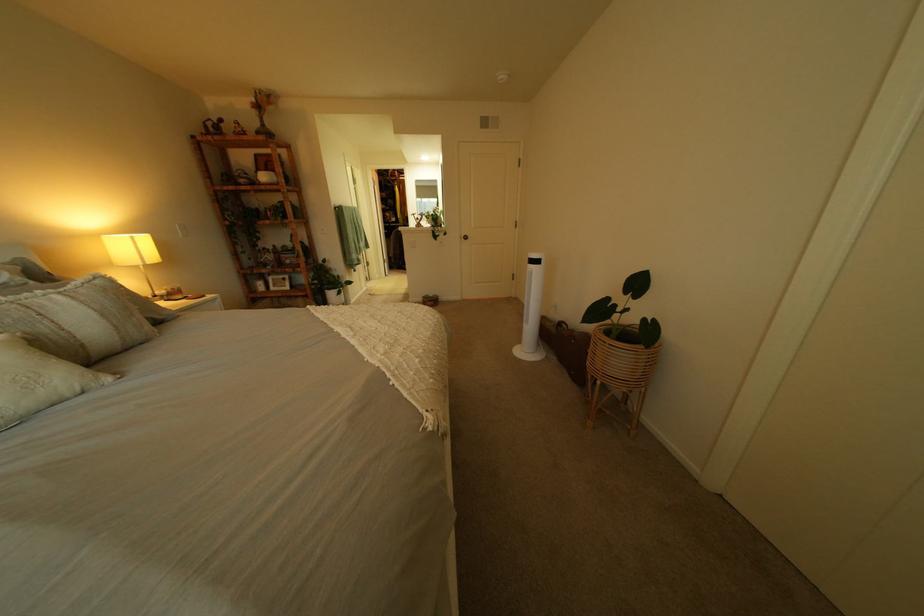
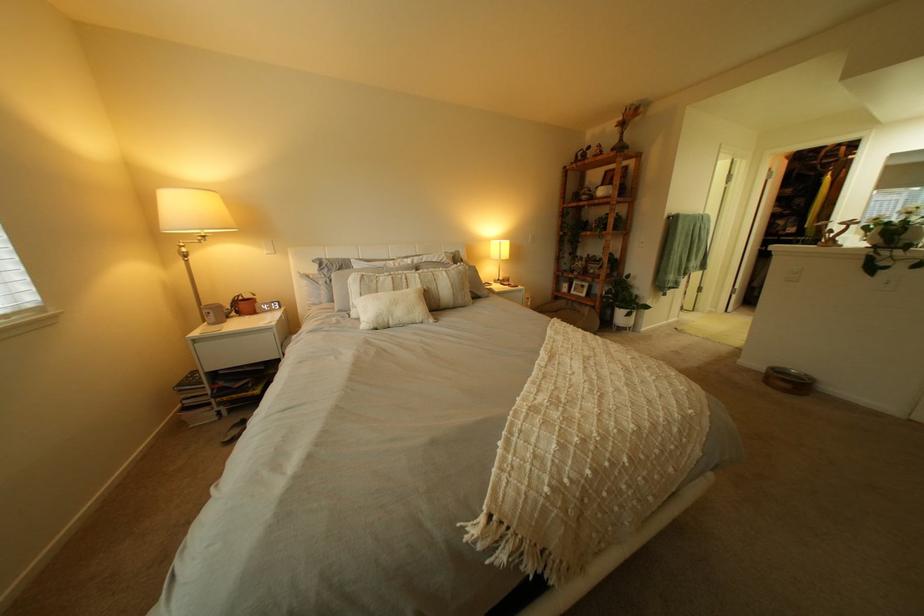
Find the pixel in the second image that matches pixel 435 301 in the first image.

(779, 369)